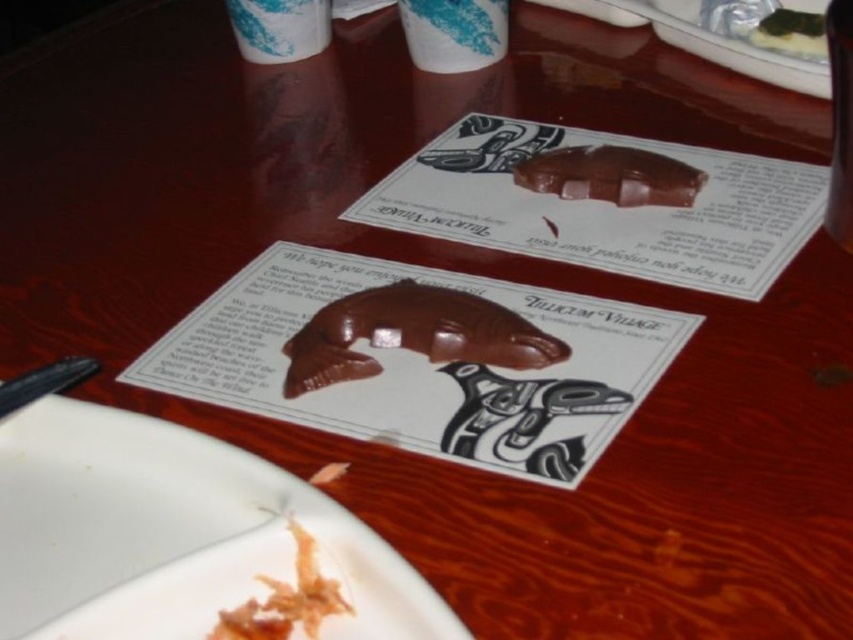
Question: Can you confirm if white matte plate at lower left is positioned to the right of shiny brown crumb at lower center?

Choices:
 (A) no
 (B) yes

Answer: (A)

Question: Which point is farther to the camera?

Choices:
 (A) (393, 554)
 (B) (450, 291)

Answer: (B)

Question: Does white matte plate at lower left appear on the right side of shiny brown crumb at lower center?

Choices:
 (A) yes
 (B) no

Answer: (B)

Question: Estimate the real-world distances between objects in this image. Which object is farther from the shiny silver platter at upper right?

Choices:
 (A) white matte plate at lower left
 (B) shiny brown chocolate at upper center
 (C) shiny brown crumb at lower center

Answer: (C)

Question: Does white matte plate at lower left appear under shiny silver platter at upper right?

Choices:
 (A) no
 (B) yes

Answer: (B)

Question: Among these objects, which one is nearest to the camera?

Choices:
 (A) shiny silver platter at upper right
 (B) white matte plate at lower left
 (C) shiny brown chocolate at upper center

Answer: (B)